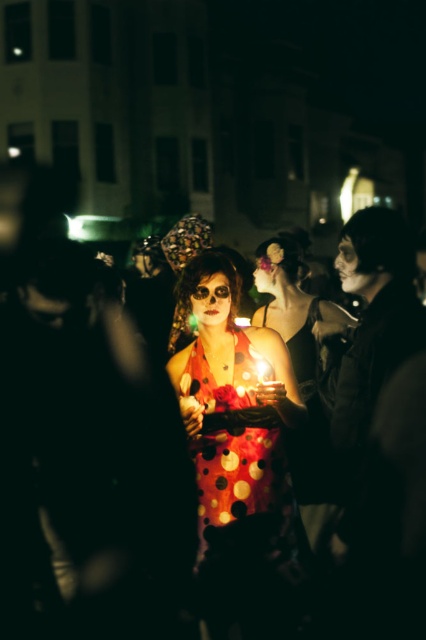
Who is positioned more to the right, polka dot dress at center or polka dot fabric dress at center?

polka dot fabric dress at center is more to the right.

Between polka dot dress at center and polka dot fabric dress at center, which one appears on the left side from the viewer's perspective?

polka dot dress at center is more to the left.

Identify the location of polka dot dress at center. (89, 464).